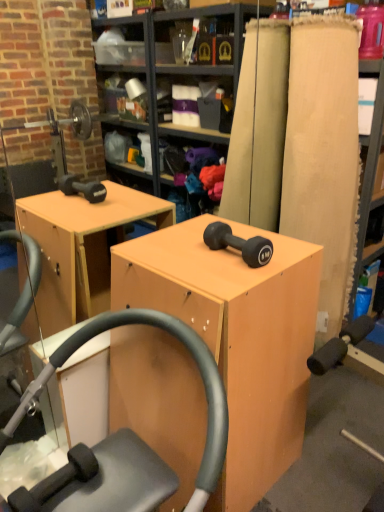
I want to click on matte wood cabinet at center, so click(236, 337).

The image size is (384, 512). What do you see at coordinates (324, 156) in the screenshot?
I see `matte wood plank at right` at bounding box center [324, 156].

Where is `matte black dumbbell at center`? This screenshot has height=512, width=384. matte black dumbbell at center is located at coordinates (239, 244).

This screenshot has height=512, width=384. Identify the location of matte wood cabinet at center. pyautogui.click(x=236, y=337).

Would you say matte black dumbbell at center is outside matte wood cabinet at center?

matte black dumbbell at center is positioned outside matte wood cabinet at center.

Which is behind, matte black dumbbell at center or matte wood cabinet at center?

Positioned behind is matte black dumbbell at center.

From the image's perspective, is matte black dumbbell at center under matte wood cabinet at center?

No.

Is matte black dumbbell at center far from matte wood cabinet at center?

No, there isn't a large distance between matte black dumbbell at center and matte wood cabinet at center.

Is matte wood cabinet at center completely or partially outside of matte wood plank at right?

Indeed, matte wood cabinet at center is completely outside matte wood plank at right.

Can you confirm if matte wood cabinet at center is positioned to the left of matte wood plank at right?

Correct, you'll find matte wood cabinet at center to the left of matte wood plank at right.

Looking at the image, does matte wood cabinet at center seem bigger or smaller compared to matte wood plank at right?

Clearly, matte wood cabinet at center is larger in size than matte wood plank at right.

From a real-world perspective, who is located lower, matte wood cabinet at center or matte wood plank at right?

matte wood cabinet at center is physically lower.

Which of these two, matte wood plank at right or matte wood cabinet at center, stands taller?

matte wood plank at right.

From a real-world perspective, which object rests below the other?

In real-world perspective, matte wood cabinet at center is lower.

Between matte wood plank at right and matte wood cabinet at center, which one appears on the left side from the viewer's perspective?

From the viewer's perspective, matte wood cabinet at center appears more on the left side.

Looking at this image, from the image's perspective, would you say matte wood plank at right is positioned over matte wood cabinet at center?

Yes, from the image's perspective, matte wood plank at right is over matte wood cabinet at center.

Does matte black dumbbell at center have a lesser height compared to matte wood plank at right?

Yes.

Can you tell me how much matte black dumbbell at center and matte wood plank at right differ in facing direction?

matte black dumbbell at center and matte wood plank at right are facing 5.32 degrees away from each other.

From the image's perspective, would you say matte black dumbbell at center is positioned over matte wood plank at right?

No.

Which of these two, matte black dumbbell at center or matte wood plank at right, is bigger?

matte wood plank at right.

Considering the relative sizes of matte wood plank at right and matte black dumbbell at center in the image provided, is matte wood plank at right thinner than matte black dumbbell at center?

Incorrect, the width of matte wood plank at right is not less than that of matte black dumbbell at center.

Is matte wood plank at right facing towards matte black dumbbell at center?

No.

In the image, there is a matte wood plank at right. Where is `dumbbell below it (from the image's perspective)`? dumbbell below it (from the image's perspective) is located at coordinates (239, 244).

The image size is (384, 512). What are the coordinates of `dumbbell behind the matte wood cabinet at center` in the screenshot? It's located at (239, 244).

Can we say matte wood cabinet at center lies outside matte black dumbbell at center?

Yes.

Is matte wood cabinet at center to the left of matte black dumbbell at center from the viewer's perspective?

Indeed, matte wood cabinet at center is positioned on the left side of matte black dumbbell at center.

Does point (133, 252) come farther from viewer compared to point (267, 241)?

Yes, point (133, 252) is behind point (267, 241).

Find the location of a particular element. Image resolution: width=384 pixels, height=512 pixels. dumbbell that appears behind the matte wood cabinet at center is located at coordinates (239, 244).

In the image, there is a matte wood cabinet at center. Where is `plank above it (from the image's perspective)`? This screenshot has height=512, width=384. plank above it (from the image's perspective) is located at coordinates (324, 156).

Looking at this image, from the image, which object appears to be nearer to matte black dumbbell at center, matte wood cabinet at center or matte wood plank at right?

matte wood cabinet at center is positioned closer to the anchor matte black dumbbell at center.

Estimate the real-world distances between objects in this image. Which object is further from matte wood plank at right, matte black dumbbell at center or matte wood cabinet at center?

matte black dumbbell at center.

Which object lies further to the anchor point matte black dumbbell at center, matte wood plank at right or matte wood cabinet at center?

matte wood plank at right.

Considering their positions, is matte black dumbbell at center positioned closer to matte wood cabinet at center than matte wood plank at right?

matte black dumbbell at center is positioned closer to the anchor matte wood cabinet at center.

Looking at this image, when comparing their distances from matte wood cabinet at center, does matte wood plank at right or matte black dumbbell at center seem closer?

matte black dumbbell at center lies closer to matte wood cabinet at center than the other object.

From the image, which object appears to be nearer to matte wood plank at right, matte wood cabinet at center or matte black dumbbell at center?

The object closer to matte wood plank at right is matte wood cabinet at center.

Find the location of a particular element. Image resolution: width=384 pixels, height=512 pixels. dumbbell that lies between matte wood plank at right and matte wood cabinet at center from top to bottom is located at coordinates (239, 244).